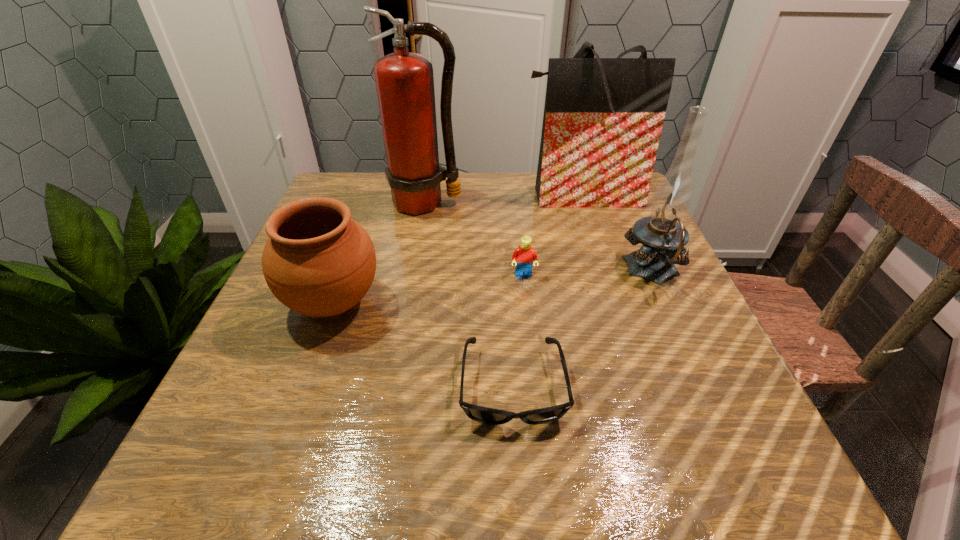
Where is `fire extinguisher`? The height and width of the screenshot is (540, 960). fire extinguisher is located at coordinates (404, 81).

This screenshot has height=540, width=960. I want to click on shopping bag, so click(x=603, y=117).

Locate an element on the screen. oil lamp is located at coordinates (663, 235).

In order to click on pottery in this screenshot , I will do click(x=318, y=261).

Where is `the fifth tallest object`? The width and height of the screenshot is (960, 540). the fifth tallest object is located at coordinates (523, 256).

You are a GUI agent. You are given a task and a screenshot of the screen. Output one action in this format:
    pyautogui.click(x=<x>, y=<y>)
    Task: Click on the shortest object
    
    Given the screenshot: What is the action you would take?
    pyautogui.click(x=486, y=415)

Where is `the nearest object`? the nearest object is located at coordinates (486, 415).

Locate an element on the screen. This screenshot has width=960, height=540. vacant space located at the nozzle of the tallest object is located at coordinates (402, 336).

What are the coordinates of `free point located on the front side of the shopping bag` in the screenshot? It's located at (592, 230).

The image size is (960, 540). I want to click on vacant space positioned 0.090m on the back of the oil lamp, so click(632, 226).